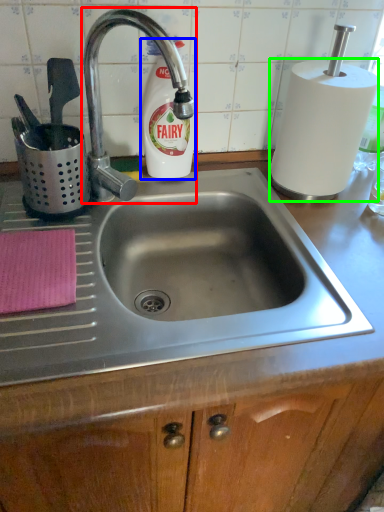
Question: Which object is the farthest from tap (highlighted by a red box)? Choose among these: cleaning product (highlighted by a blue box) or paper towel (highlighted by a green box).

Choices:
 (A) cleaning product
 (B) paper towel

Answer: (B)